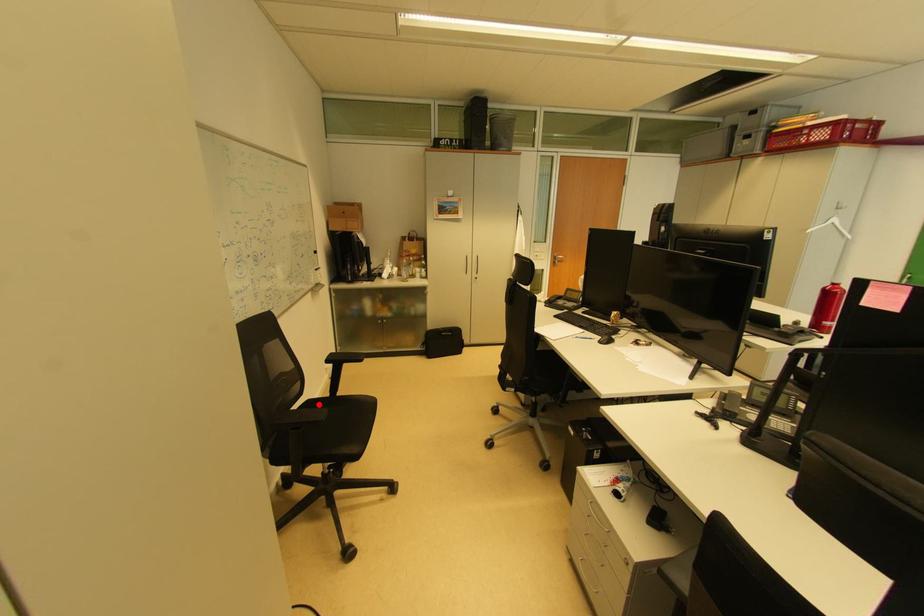
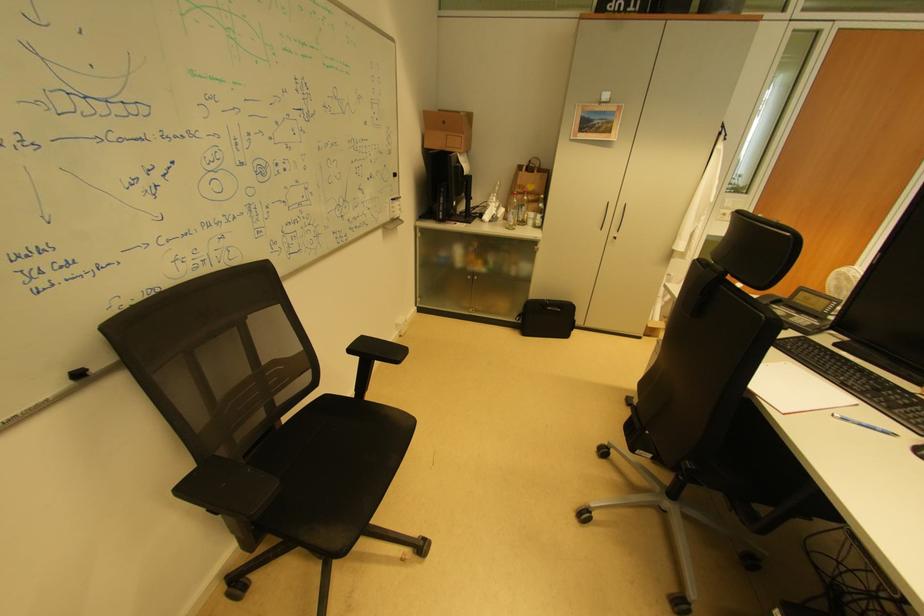
In the second image, find the point that corresponds to the highlighted location in the first image.

(335, 400)